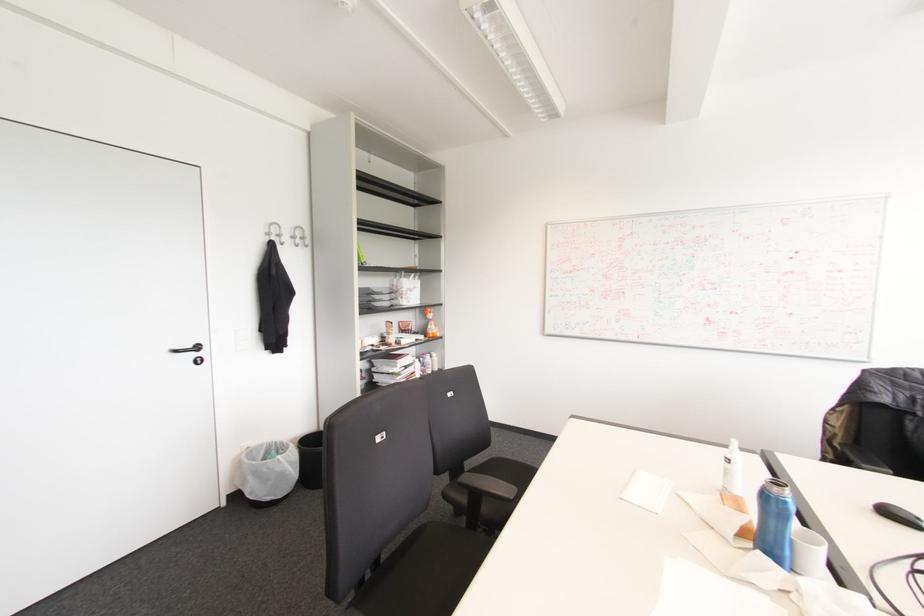
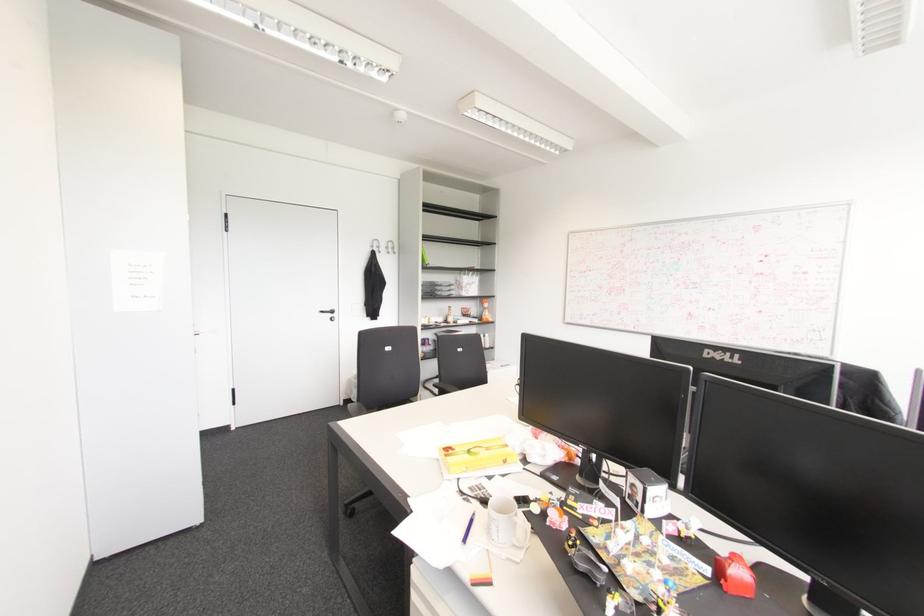
Where in the second image is the point corresponding to point (266, 233) from the first image?

(371, 246)